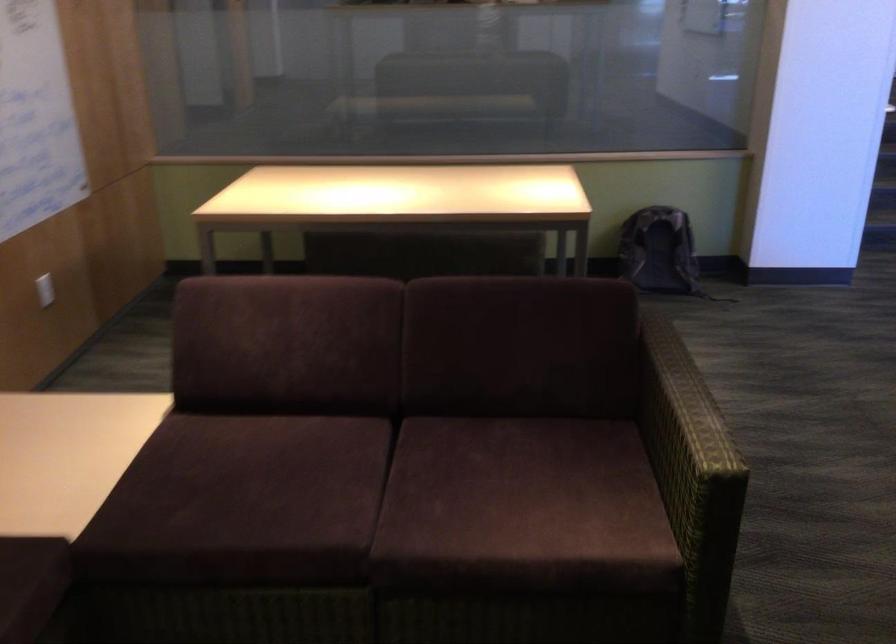
At what (x,y) coordinates should I click in order to perform the action: click on white light switch. Please return your answer as a coordinate pair (x, y). Looking at the image, I should click on (45, 289).